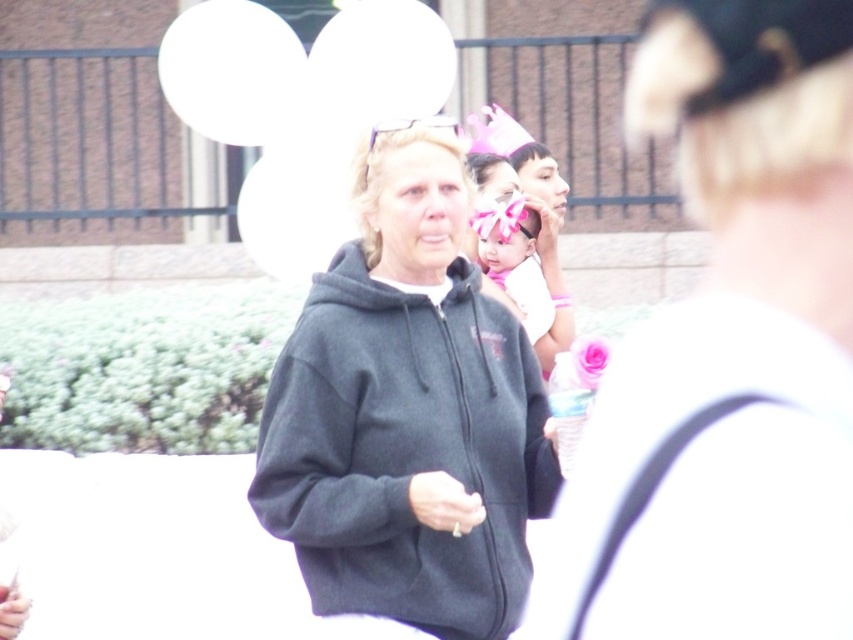
Describe the element at coordinates (407, 413) in the screenshot. The height and width of the screenshot is (640, 853). I see `dark gray hoodie at center` at that location.

Does point (482, 308) come in front of point (495, 250)?

Yes, point (482, 308) is in front of point (495, 250).

What do you see at coordinates (407, 413) in the screenshot? The height and width of the screenshot is (640, 853). I see `dark gray hoodie at center` at bounding box center [407, 413].

At what (x,y) coordinates should I click in order to perform the action: click on dark gray hoodie at center. Please return your answer as a coordinate pair (x, y). Looking at the image, I should click on (407, 413).